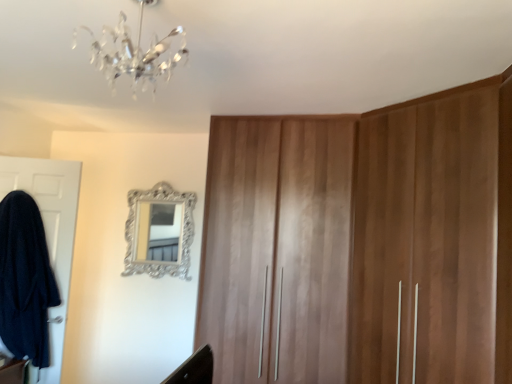
Describe the element at coordinates (50, 235) in the screenshot. I see `white matte door at left` at that location.

The width and height of the screenshot is (512, 384). In order to click on wooden wardrobe at center in this screenshot , I will do `click(277, 249)`.

From the image's perspective, is silver ornate mirror at upper center located above or below white matte door at left?

Based on their image positions, silver ornate mirror at upper center is located above white matte door at left.

Is silver ornate mirror at upper center next to white matte door at left and touching it?

They are not placed beside each other.

Can you confirm if silver ornate mirror at upper center is thinner than white matte door at left?

Yes.

Considering the positions of objects silver ornate mirror at upper center and white matte door at left in the image provided, who is more to the right, silver ornate mirror at upper center or white matte door at left?

Positioned to the right is silver ornate mirror at upper center.

From a real-world perspective, between white matte door at left and crystal glass chandelier at upper center, who is vertically lower?

From a 3D spatial view, white matte door at left is below.

You are a GUI agent. You are given a task and a screenshot of the screen. Output one action in this format:
    pyautogui.click(x=<x>, y=<y>)
    Task: Click on the light fixture in front of the white matte door at left
    The height and width of the screenshot is (384, 512).
    Given the screenshot: What is the action you would take?
    tap(134, 53)

Is the depth of white matte door at left greater than that of crystal glass chandelier at upper center?

Yes, white matte door at left is further from the camera.

Would you say white matte door at left is inside or outside crystal glass chandelier at upper center?

white matte door at left is not enclosed by crystal glass chandelier at upper center.

Is wooden wardrobe at center aimed at white matte door at left?

No, wooden wardrobe at center is not oriented towards white matte door at left.

Which object is more forward, wooden wardrobe at center or white matte door at left?

wooden wardrobe at center.

Does wooden wardrobe at center have a lesser height compared to white matte door at left?

No, wooden wardrobe at center is not shorter than white matte door at left.

Is point (287, 140) positioned after point (38, 161)?

That is False.

Is crystal glass chandelier at upper center touching wooden wardrobe at center?

No, crystal glass chandelier at upper center is not making contact with wooden wardrobe at center.

Is point (140, 68) closer to camera compared to point (301, 265)?

Yes.

From the image's perspective, which one is positioned higher, crystal glass chandelier at upper center or wooden wardrobe at center?

crystal glass chandelier at upper center appears higher in the image.

From the image's perspective, is silver ornate mirror at upper center located above or below wooden wardrobe at center?

silver ornate mirror at upper center is above wooden wardrobe at center.

From their relative heights in the image, would you say silver ornate mirror at upper center is taller or shorter than wooden wardrobe at center?

Clearly, silver ornate mirror at upper center is shorter compared to wooden wardrobe at center.

Is point (183, 230) closer or farther from the camera than point (262, 240)?

Point (183, 230).

Is silver ornate mirror at upper center completely or partially outside of wooden wardrobe at center?

silver ornate mirror at upper center is positioned outside wooden wardrobe at center.

Looking at their sizes, would you say crystal glass chandelier at upper center is wider or thinner than white matte door at left?

In the image, crystal glass chandelier at upper center appears to be wider than white matte door at left.

Locate an element on the screen. The image size is (512, 384). light fixture above the white matte door at left (from the image's perspective) is located at coordinates (134, 53).

Is point (124, 68) positioned after point (52, 182)?

No, (124, 68) is closer to viewer.

Are crystal glass chandelier at upper center and white matte door at left far apart?

Yes, crystal glass chandelier at upper center and white matte door at left are located far from each other.

Measure the distance between white matte door at left and wooden wardrobe at center.

white matte door at left and wooden wardrobe at center are 1.44 meters apart.

Is white matte door at left directly adjacent to wooden wardrobe at center?

No, white matte door at left is not in contact with wooden wardrobe at center.

Between white matte door at left and wooden wardrobe at center, which one has larger size?

wooden wardrobe at center.

Does white matte door at left have a greater height compared to wooden wardrobe at center?

No, white matte door at left is not taller than wooden wardrobe at center.

At what (x,y) coordinates should I click in order to perform the action: click on door below the silver ornate mirror at upper center (from a real-world perspective). Please return your answer as a coordinate pair (x, y). Looking at the image, I should click on (50, 235).

Find the location of a particular element. The image size is (512, 384). door below the crystal glass chandelier at upper center (from the image's perspective) is located at coordinates (50, 235).

Estimate the real-world distances between objects in this image. Which object is further from crystal glass chandelier at upper center, white matte door at left or wooden wardrobe at center?

white matte door at left is positioned further to the anchor crystal glass chandelier at upper center.

From the image, which object appears to be farther from crystal glass chandelier at upper center, wooden wardrobe at center or silver ornate mirror at upper center?

silver ornate mirror at upper center lies further to crystal glass chandelier at upper center than the other object.

Based on their spatial positions, is crystal glass chandelier at upper center or silver ornate mirror at upper center closer to wooden wardrobe at center?

silver ornate mirror at upper center is positioned closer to the anchor wooden wardrobe at center.

Looking at the image, which one is located closer to silver ornate mirror at upper center, white matte door at left or crystal glass chandelier at upper center?

white matte door at left lies closer to silver ornate mirror at upper center than the other object.

Which object lies further to the anchor point silver ornate mirror at upper center, crystal glass chandelier at upper center or white matte door at left?

Based on the image, crystal glass chandelier at upper center appears to be further to silver ornate mirror at upper center.

In the scene shown: Estimate the real-world distances between objects in this image. Which object is closer to white matte door at left, wooden wardrobe at center or silver ornate mirror at upper center?

silver ornate mirror at upper center is positioned closer to the anchor white matte door at left.

Looking at the image, which one is located further to silver ornate mirror at upper center, wooden wardrobe at center or crystal glass chandelier at upper center?

Among the two, crystal glass chandelier at upper center is located further to silver ornate mirror at upper center.

Estimate the real-world distances between objects in this image. Which object is further from wooden wardrobe at center, silver ornate mirror at upper center or crystal glass chandelier at upper center?

crystal glass chandelier at upper center lies further to wooden wardrobe at center than the other object.

You are a GUI agent. You are given a task and a screenshot of the screen. Output one action in this format:
    pyautogui.click(x=<x>, y=<y>)
    Task: Click on the light fixture situated between white matte door at left and wooden wardrobe at center from left to right
    
    Given the screenshot: What is the action you would take?
    pyautogui.click(x=134, y=53)

At what (x,y) coordinates should I click in order to perform the action: click on door between crystal glass chandelier at upper center and silver ornate mirror at upper center along the z-axis. Please return your answer as a coordinate pair (x, y). Looking at the image, I should click on (50, 235).

Image resolution: width=512 pixels, height=384 pixels. Find the location of `locker between crystal glass chandelier at upper center and silver ornate mirror at upper center in the front-back direction`. locker between crystal glass chandelier at upper center and silver ornate mirror at upper center in the front-back direction is located at coordinates (277, 249).

The image size is (512, 384). In order to click on mirror located between white matte door at left and wooden wardrobe at center in the left-right direction in this screenshot , I will do `click(159, 232)`.